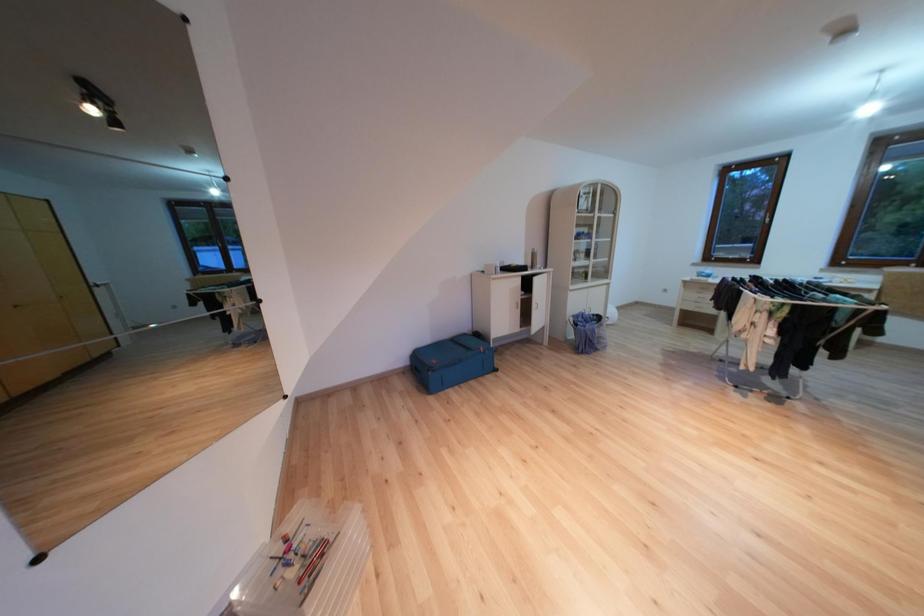
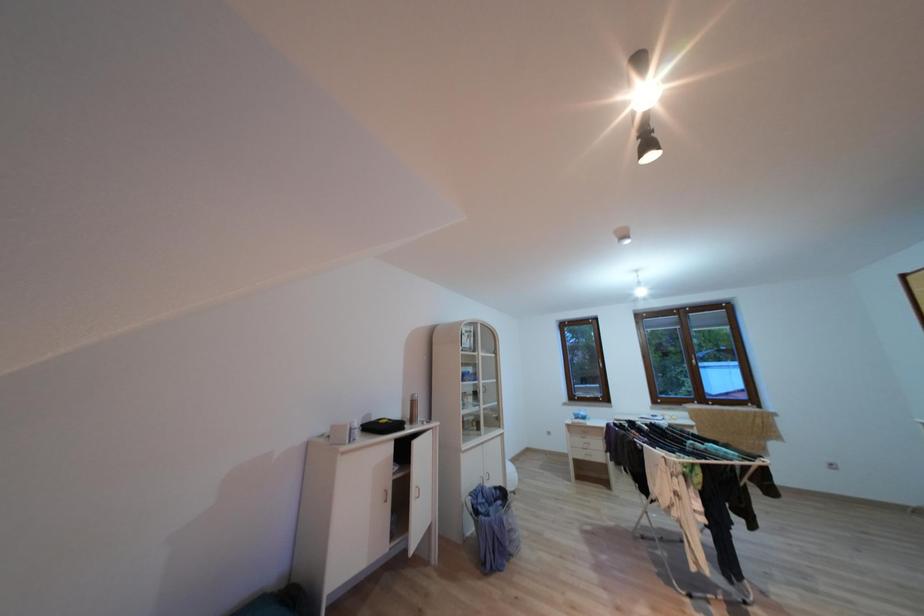
First-person continuous shooting, in which direction is the camera rotating?

The camera rotated toward right-up.